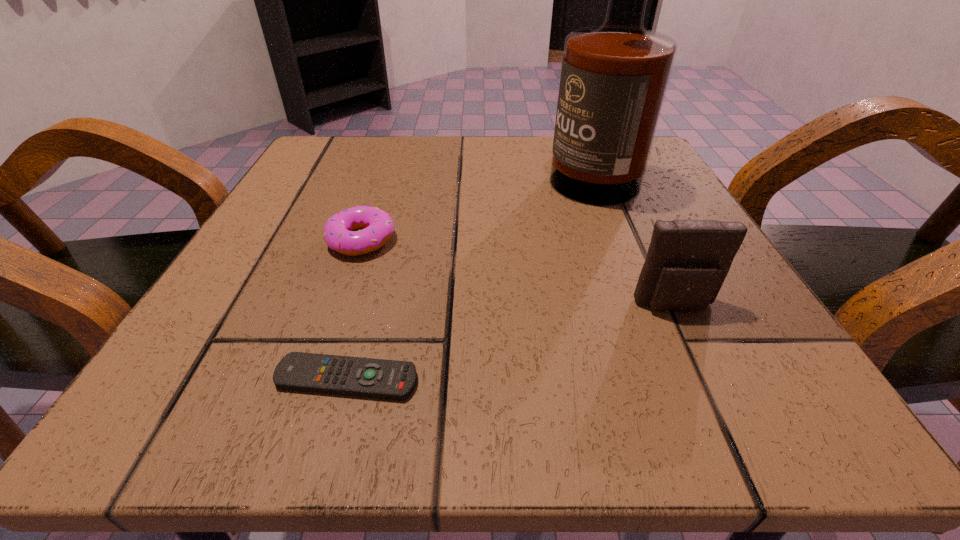
Locate an element on the screen. The image size is (960, 540). liquor is located at coordinates (614, 77).

At what (x,y) coordinates should I click in order to perform the action: click on the tallest object. Please return your answer as a coordinate pair (x, y). This screenshot has width=960, height=540. Looking at the image, I should click on (614, 77).

Where is `the third shortest object`? The height and width of the screenshot is (540, 960). the third shortest object is located at coordinates (687, 262).

Image resolution: width=960 pixels, height=540 pixels. Identify the location of pouch. (687, 262).

This screenshot has height=540, width=960. Identify the location of the third nearest object. (x=377, y=226).

The width and height of the screenshot is (960, 540). Identify the location of the second shortest object. (377, 226).

Locate an element on the screen. the shortest object is located at coordinates (377, 378).

Identify the location of the nearest object. The width and height of the screenshot is (960, 540). (377, 378).

The width and height of the screenshot is (960, 540). I want to click on vacant space situated 0.110m on the front label of the farthest object, so click(x=491, y=167).

Where is `free space located 0.310m on the front label of the farthest object`? free space located 0.310m on the front label of the farthest object is located at coordinates (391, 167).